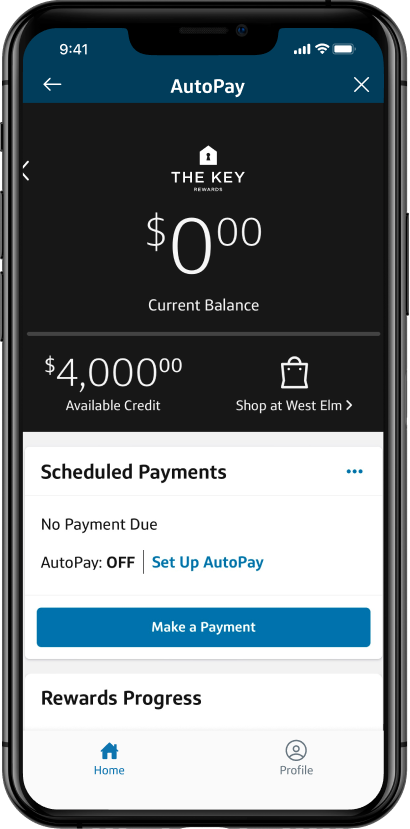
Identify the location of wifi. Image resolution: width=410 pixels, height=829 pixels. (324, 49).